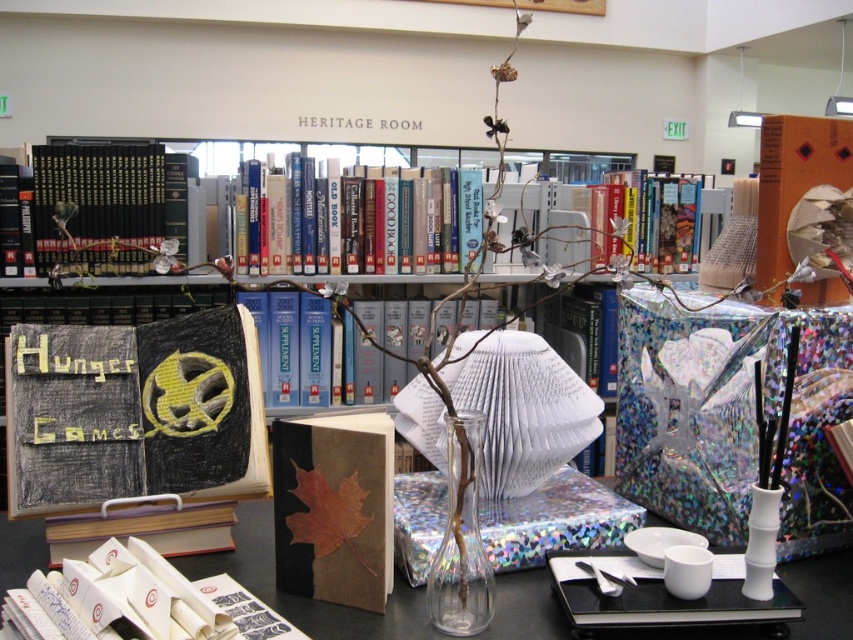
From the picture: You are organizing a book display and have two books at the center of the table. The hardcover books at center and the brown paper book at center. Which one is bigger?

The hardcover books at center is larger in size compared to the brown paper book at center.

You are a visitor in the Heritage Room and see the hardcover books at center and the transparent glass vase at center. Which object is closer to you?

The hardcover books at center is positioned over transparent glass vase at center, so the hardcover books at center is closer to you.